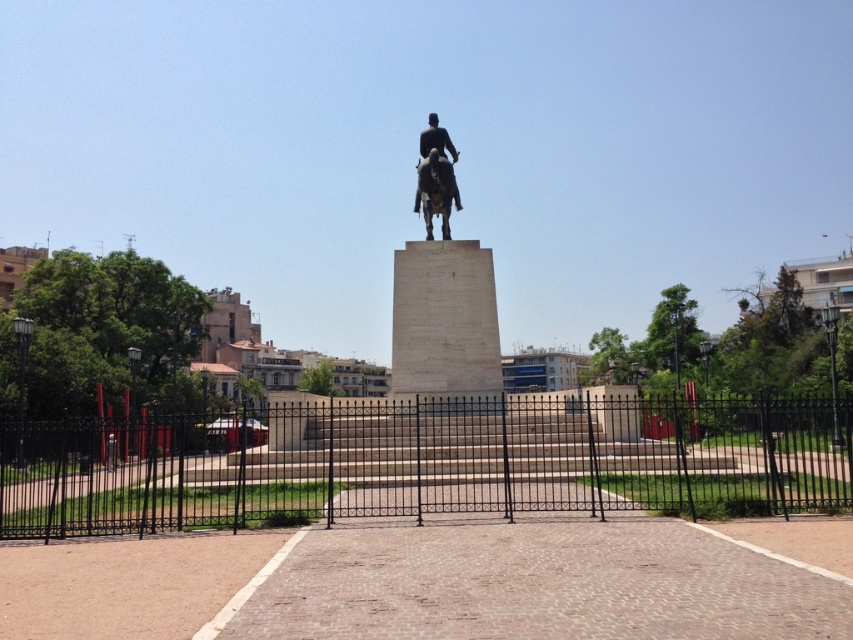
You are a tour guide explaining the statue to visitors. You point out the bronze metallic horse at center and the black polished statue at center. Which one is positioned lower in the scene?

The bronze metallic horse at center is positioned lower than the black polished statue at center.

From the picture: You are a tour guide explaining the statue to visitors. You point out the bronze metallic horse at center and the black polished statue at center. Which one is closer to the visitors standing in front of the statue?

The bronze metallic horse at center is closer to the visitors because it is positioned in front of the black polished statue at center.